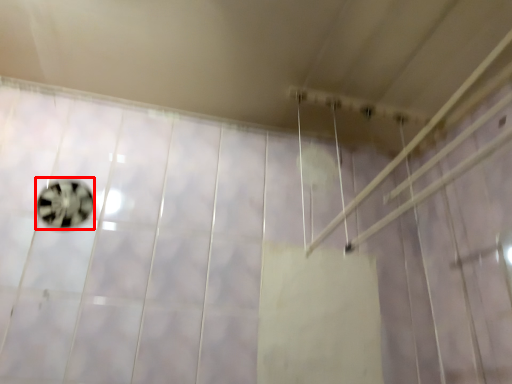
Question: Considering the relative positions of ball (annotated by the red box) and shower in the image provided, where is ball (annotated by the red box) located with respect to the staircase?

Choices:
 (A) right
 (B) left

Answer: (B)